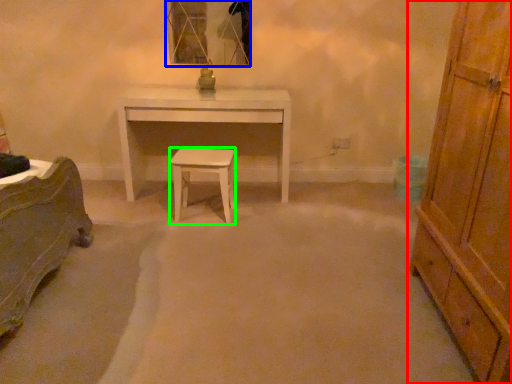
Question: Which object is positioned farthest from chest of drawers (highlighted by a red box)? Select from mirror (highlighted by a blue box) and stool (highlighted by a green box).

Choices:
 (A) mirror
 (B) stool

Answer: (A)